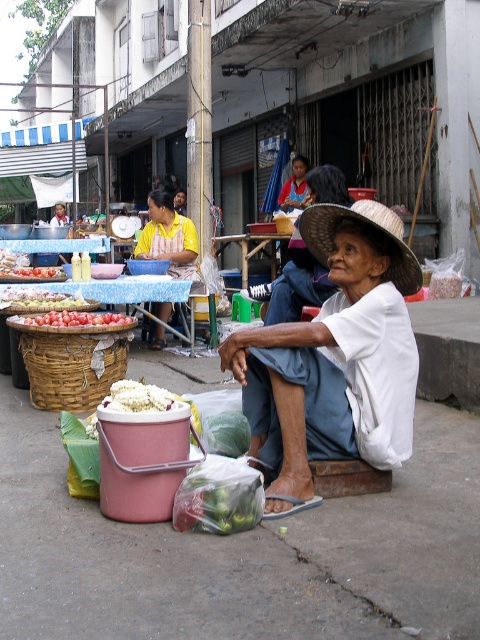
Which is more to the left, pink plastic bucket at lower center or yellow fabric apron at center?

Positioned to the left is yellow fabric apron at center.

Is pink plastic bucket at lower center shorter than yellow fabric apron at center?

Indeed, pink plastic bucket at lower center has a lesser height compared to yellow fabric apron at center.

Locate an element on the screen. This screenshot has height=640, width=480. pink plastic bucket at lower center is located at coordinates (242, 552).

You are a GUI agent. You are given a task and a screenshot of the screen. Output one action in this format:
    pyautogui.click(x=<x>, y=<y>)
    Task: Click on the pink plastic bucket at lower center
    
    Given the screenshot: What is the action you would take?
    pyautogui.click(x=242, y=552)

Who is lower down, white cotton hat at center or yellow fabric apron at center?

white cotton hat at center is lower down.

Between white cotton hat at center and yellow fabric apron at center, which one appears on the right side from the viewer's perspective?

white cotton hat at center

Does point (303, 452) lie in front of point (155, 234)?

Yes, it is.

What are the coordinates of `white cotton hat at center` in the screenshot? It's located at (335, 358).

Locate an element on the screen. white cotton hat at center is located at coordinates (335, 358).

Can you confirm if white cotton hat at center is bigger than strawmaterial/texturehat at center?

Yes.

Is point (325, 346) closer to viewer compared to point (409, 248)?

That is True.

Where is `white cotton hat at center`? This screenshot has height=640, width=480. white cotton hat at center is located at coordinates (335, 358).